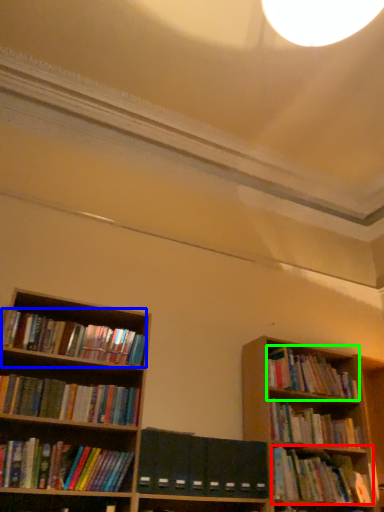
Question: Which is farther away from book (highlighted by a red box)? book (highlighted by a blue box) or book (highlighted by a green box)?

Choices:
 (A) book
 (B) book

Answer: (A)